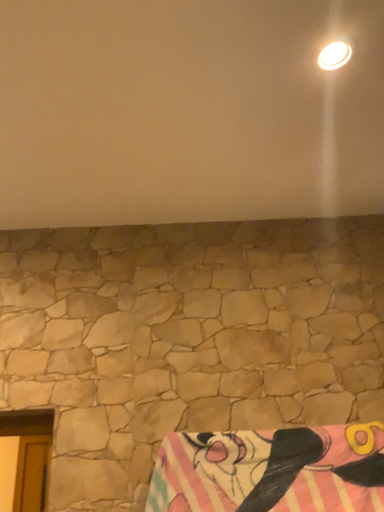
In order to face beige stone wall at upper center, should I rotate leftwards or rightwards?

Turn right by 0.598 degrees to look at beige stone wall at upper center.

The image size is (384, 512). What do you see at coordinates (188, 111) in the screenshot?
I see `beige stone wall at upper center` at bounding box center [188, 111].

Identify the location of beige stone wall at upper center. (188, 111).

Where is `beige stone wall at upper center`? This screenshot has width=384, height=512. beige stone wall at upper center is located at coordinates (188, 111).